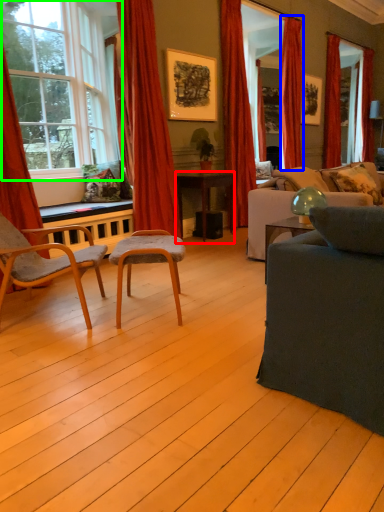
Question: Which is farther away from desk (highlighted by a red box)? curtain (highlighted by a blue box) or window (highlighted by a green box)?

Choices:
 (A) curtain
 (B) window

Answer: (B)